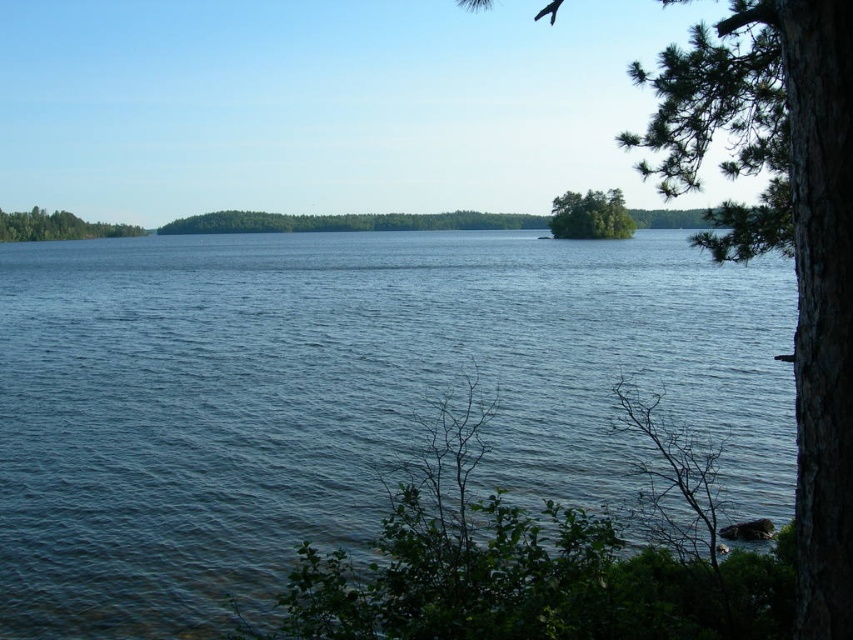
Question: Where is green textured tree at center right located in relation to green leafy island at center in the image?

Choices:
 (A) below
 (B) above

Answer: (B)

Question: Estimate the real-world distances between objects in this image. Which object is farther from the green leafy tree at left?

Choices:
 (A) green leafy tree at center
 (B) green textured tree at center right

Answer: (B)

Question: Is green textured tree at center right above green leafy tree at center?

Choices:
 (A) yes
 (B) no

Answer: (A)

Question: Where is green textured tree at center right located in relation to green leafy tree at center in the image?

Choices:
 (A) left
 (B) right

Answer: (B)

Question: Among these objects, which one is farthest from the camera?

Choices:
 (A) green leafy tree at center
 (B) green leafy tree at left
 (C) green leafy island at center

Answer: (A)

Question: Which object appears closest to the camera in this image?

Choices:
 (A) blue water at center
 (B) green textured tree at center right
 (C) green leafy island at center

Answer: (B)